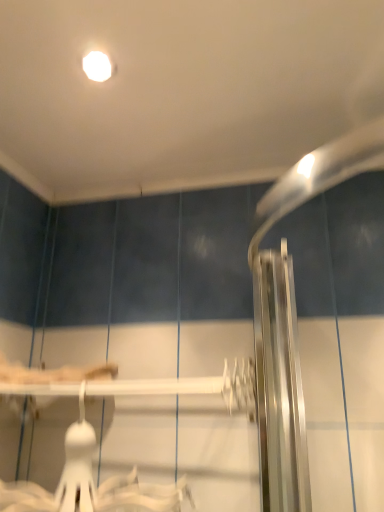
You are a GUI agent. You are given a task and a screenshot of the screen. Output one action in this format:
    pyautogui.click(x=<x>, y=<y>)
    Task: Click on the white plastic hanger at lower center
    The width and height of the screenshot is (384, 512).
    Given the screenshot: What is the action you would take?
    pyautogui.click(x=95, y=446)

This screenshot has height=512, width=384. What do you see at coordinates (95, 446) in the screenshot? I see `white plastic hanger at lower center` at bounding box center [95, 446].

Find the location of a particular element. The height and width of the screenshot is (512, 384). white plastic hanger at lower center is located at coordinates (95, 446).